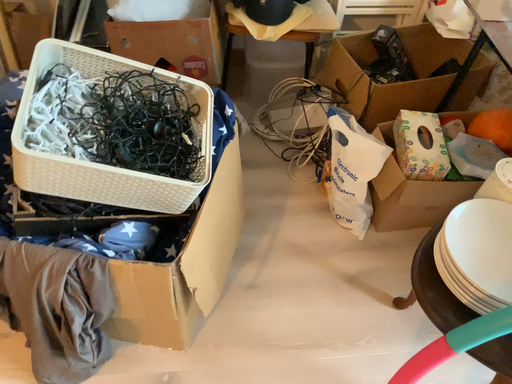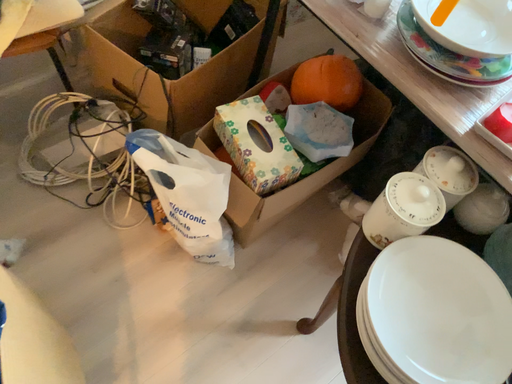
Question: Which way did the camera rotate in the video?

Choices:
 (A) rotated left
 (B) rotated right

Answer: (B)